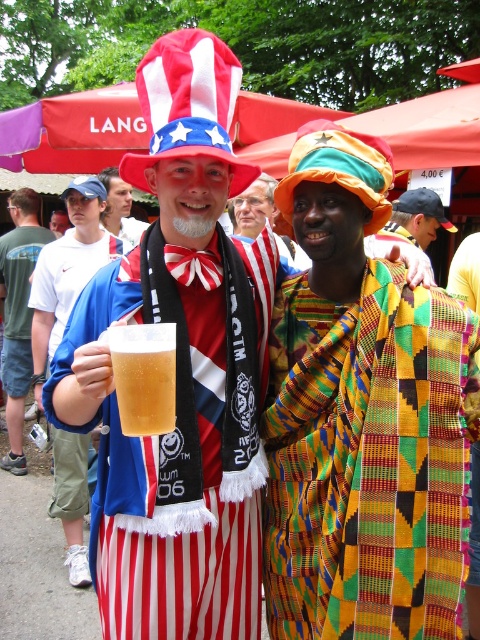
Who is positioned more to the left, matte glass mug at center or matte red and white striped hat at center?

From the viewer's perspective, matte glass mug at center appears more on the left side.

From the picture: Does matte glass mug at center have a larger size compared to matte red and white striped hat at center?

Yes, matte glass mug at center is bigger than matte red and white striped hat at center.

The width and height of the screenshot is (480, 640). Identify the location of matte glass mug at center. (179, 454).

Can you confirm if kente cloth shawl at center is positioned below translucent glass mug at center?

Yes, kente cloth shawl at center is below translucent glass mug at center.

Is point (290, 468) positioned after point (10, 348)?

No, it is not.

The width and height of the screenshot is (480, 640). I want to click on kente cloth shawl at center, so click(x=368, y=461).

Between point (10, 424) and point (120, 225), which one is positioned behind?

Point (10, 424)

Which is in front, point (25, 220) or point (116, 221)?

Point (116, 221) is more forward.

Does point (21, 470) come closer to viewer compared to point (116, 172)?

No, (21, 470) is behind (116, 172).

Where is `translucent glass mug at center`? This screenshot has width=480, height=640. translucent glass mug at center is located at coordinates (19, 314).